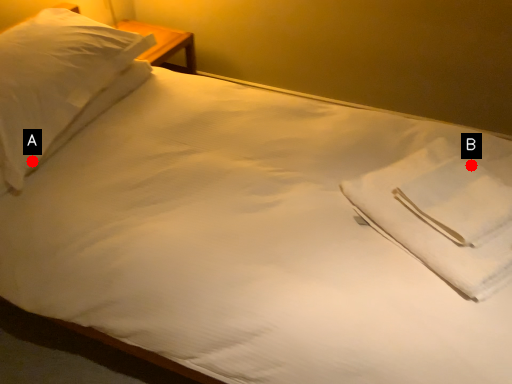
Question: Two points are circled on the image, labeled by A and B beside each circle. Which point is farther from the camera taking this photo?

Choices:
 (A) A is further
 (B) B is further

Answer: (B)